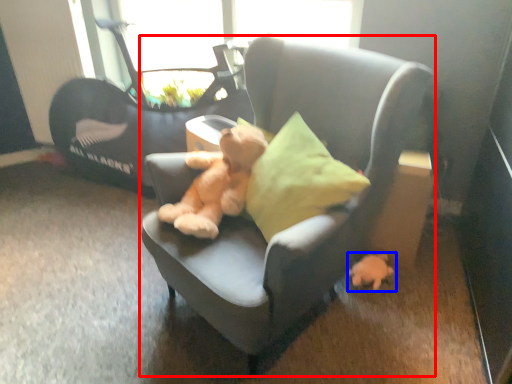
Question: Which object is closer to the camera taking this photo, chair (highlighted by a red box) or toy (highlighted by a blue box)?

Choices:
 (A) chair
 (B) toy

Answer: (A)